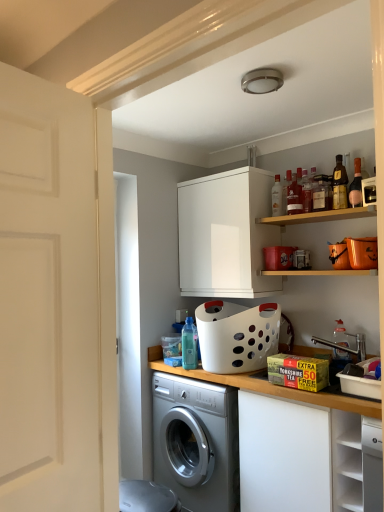
Question: Is white matte cabinet at upper center, marked as the 1th cabinetry in a top-to-bottom arrangement, bigger than translucent glass bottle at upper center, marked as the 5th bottle in a right-to-left arrangement?

Choices:
 (A) yes
 (B) no

Answer: (A)

Question: From a real-world perspective, is white matte cabinet at upper center, marked as the 1th cabinetry in a top-to-bottom arrangement, under translucent glass bottle at upper center, marked as the 5th bottle in a right-to-left arrangement?

Choices:
 (A) yes
 (B) no

Answer: (A)

Question: Is white matte cabinet at upper center, the second cabinetry when ordered from front to back, positioned beyond the bounds of translucent glass bottle at upper center, positioned as the 3th bottle in left-to-right order?

Choices:
 (A) yes
 (B) no

Answer: (A)

Question: Is translucent glass bottle at upper center, positioned as the 3th bottle in left-to-right order, surrounded by white matte cabinet at upper center, marked as the 1th cabinetry in a top-to-bottom arrangement?

Choices:
 (A) yes
 (B) no

Answer: (B)

Question: Considering the relative positions of white matte cabinet at upper center, the second cabinetry when ordered from front to back, and translucent glass bottle at upper center, marked as the 5th bottle in a right-to-left arrangement, in the image provided, is white matte cabinet at upper center, the second cabinetry when ordered from front to back, in front of translucent glass bottle at upper center, marked as the 5th bottle in a right-to-left arrangement,?

Choices:
 (A) no
 (B) yes

Answer: (A)

Question: Does white matte cabinet at upper center, the second cabinetry when ordered from front to back, have a smaller size compared to translucent glass bottle at upper center, positioned as the 3th bottle in left-to-right order?

Choices:
 (A) yes
 (B) no

Answer: (B)

Question: Does translucent plastic bottle at center, the first bottle from the left, have a smaller size compared to white plastic basket at center?

Choices:
 (A) no
 (B) yes

Answer: (B)

Question: From a real-world perspective, is translucent plastic bottle at center, which is the 7th bottle in right-to-left order, under white plastic basket at center?

Choices:
 (A) yes
 (B) no

Answer: (B)

Question: Does translucent plastic bottle at center, which is the 7th bottle in right-to-left order, come behind white plastic basket at center?

Choices:
 (A) yes
 (B) no

Answer: (A)

Question: Is translucent plastic bottle at center, the first bottle from the left, closer to camera compared to white plastic basket at center?

Choices:
 (A) yes
 (B) no

Answer: (B)

Question: Could you tell me if translucent plastic bottle at center, which is the 7th bottle in right-to-left order, is facing white plastic basket at center?

Choices:
 (A) yes
 (B) no

Answer: (B)

Question: Does pink glass bottle at upper right, which is the 7th bottle in left-to-right order, have a lesser width compared to translucent glass bottle at upper center, placed as the 4th bottle when sorted from right to left?

Choices:
 (A) yes
 (B) no

Answer: (A)